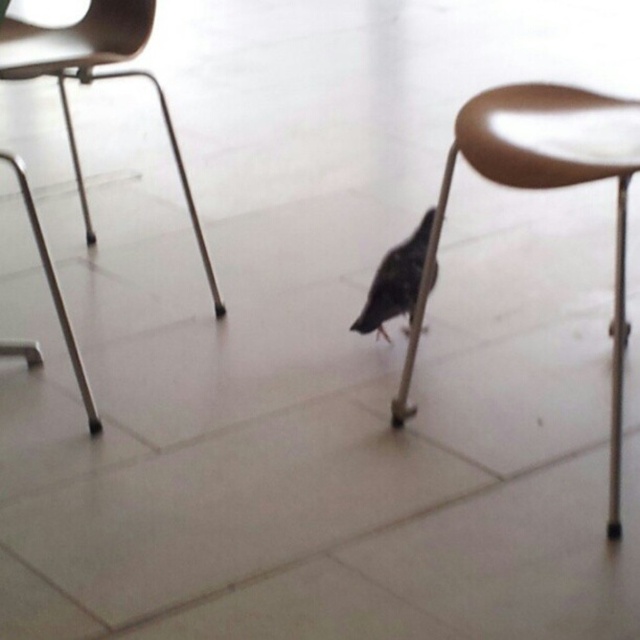
Does point (618, 397) come in front of point (413, 234)?

Yes, it is.

Does matte brown stool at center have a lesser height compared to dark gray matte bird at center?

In fact, matte brown stool at center may be taller than dark gray matte bird at center.

Image resolution: width=640 pixels, height=640 pixels. What are the coordinates of `matte brown stool at center` in the screenshot? It's located at (536, 188).

Between point (461, 141) and point (56, 52), which one is positioned behind?

Positioned behind is point (56, 52).

Is matte brown stool at center taller than matte wood chair at left?

Indeed, matte brown stool at center has a greater height compared to matte wood chair at left.

You are a GUI agent. You are given a task and a screenshot of the screen. Output one action in this format:
    pyautogui.click(x=<x>, y=<y>)
    Task: Click on the matte brown stool at center
    The width and height of the screenshot is (640, 640).
    Given the screenshot: What is the action you would take?
    pyautogui.click(x=536, y=188)

Can you confirm if matte wood chair at left is shorter than dark gray matte bird at center?

No, matte wood chair at left is not shorter than dark gray matte bird at center.

Is matte wood chair at left bigger than dark gray matte bird at center?

Indeed, matte wood chair at left has a larger size compared to dark gray matte bird at center.

Which is behind, point (29, 29) or point (387, 337)?

The point (29, 29) is more distant.

The height and width of the screenshot is (640, 640). In order to click on matte wood chair at left in this screenshot , I will do `click(93, 77)`.